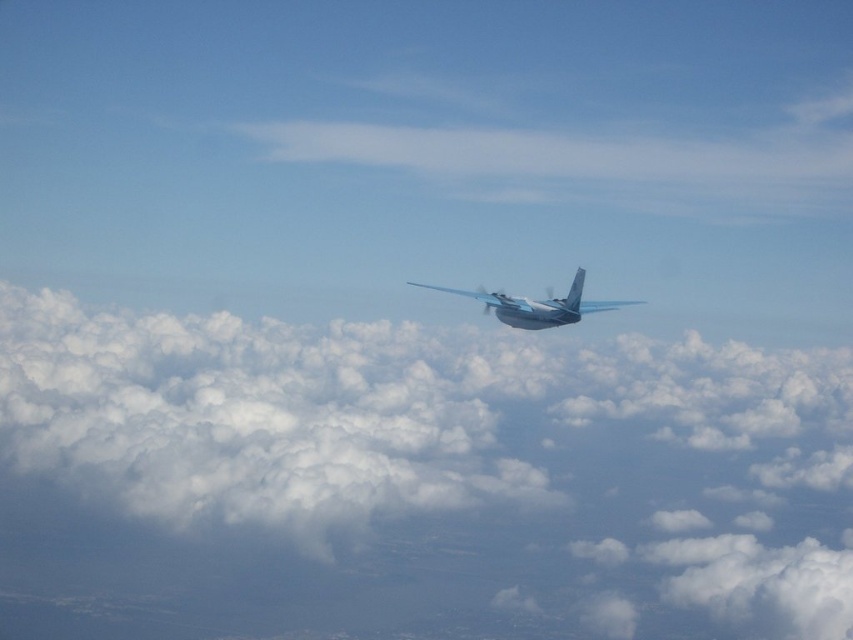
From the picture: Can you confirm if white fluffy cloud at center is shorter than metallic silver airplane at center?

In fact, white fluffy cloud at center may be taller than metallic silver airplane at center.

Can you confirm if white fluffy cloud at center is bigger than metallic silver airplane at center?

Yes, white fluffy cloud at center is bigger than metallic silver airplane at center.

Locate an element on the screen. This screenshot has width=853, height=640. white fluffy cloud at center is located at coordinates (415, 477).

Where is `white fluffy cloud at center`? Image resolution: width=853 pixels, height=640 pixels. white fluffy cloud at center is located at coordinates click(x=415, y=477).